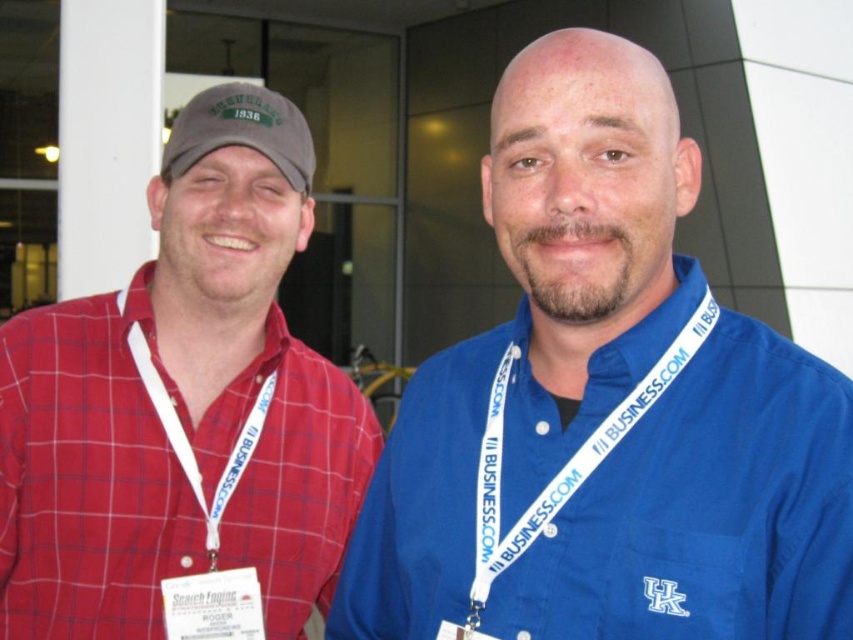
Question: Can you confirm if white plastic lanyard at center is positioned to the right of white fabric lanyard at left?

Choices:
 (A) yes
 (B) no

Answer: (A)

Question: Can you confirm if blue cotton shirt at center is smaller than matte red shirt at left?

Choices:
 (A) yes
 (B) no

Answer: (B)

Question: Can you confirm if matte red plaid shirt at left is positioned below white plastic lanyard at center?

Choices:
 (A) yes
 (B) no

Answer: (B)

Question: Which of the following is the closest to the observer?

Choices:
 (A) matte red shirt at left
 (B) blue cotton shirt at center

Answer: (B)

Question: Based on their relative distances, which object is nearer to the white fabric lanyard at left?

Choices:
 (A) matte red shirt at left
 (B) green fabric baseball cap at upper left

Answer: (A)

Question: Which point is farther to the camera?

Choices:
 (A) matte red shirt at left
 (B) white fabric lanyard at left
 (C) white plastic lanyard at center
 (D) beige fabric neck at center

Answer: (A)